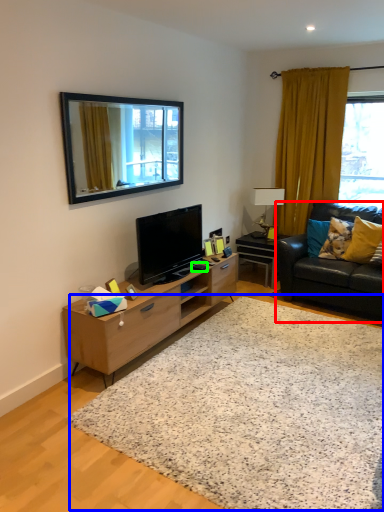
Question: Which is nearer to the studio couch (highlighted by a red box)? plain (highlighted by a blue box) or remote control (highlighted by a green box).

Choices:
 (A) plain
 (B) remote control

Answer: (B)